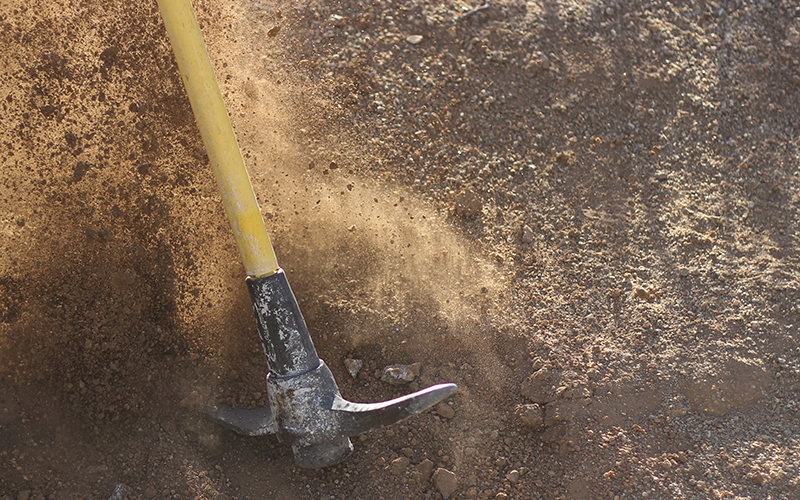
Image resolution: width=800 pixels, height=500 pixels. Find the location of `illuminated area`. illuminated area is located at coordinates (276, 149).